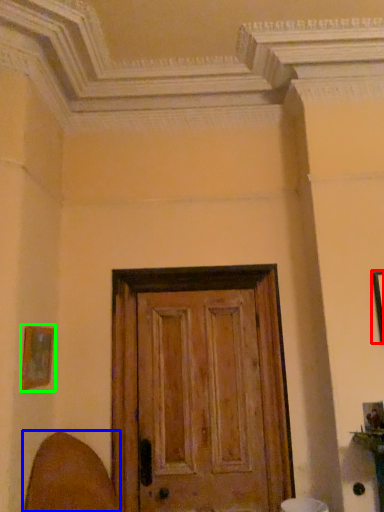
Question: Estimate the real-world distances between objects in this image. Which object is closer to picture frame (highlighted by a red box), swivel chair (highlighted by a blue box) or picture frame (highlighted by a green box)?

Choices:
 (A) swivel chair
 (B) picture frame

Answer: (B)